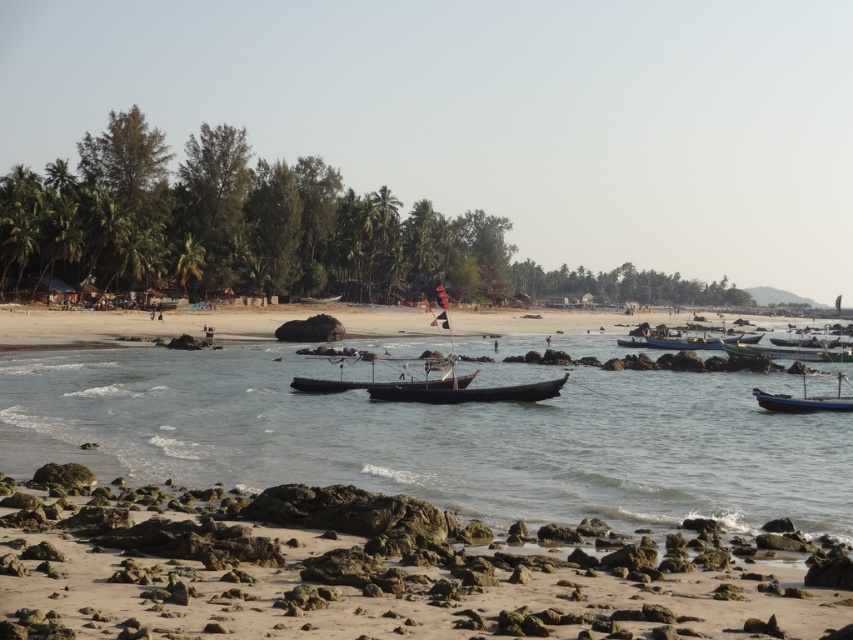
Question: Does green wooden boat at right come in front of blue wooden boat at lower right?

Choices:
 (A) no
 (B) yes

Answer: (A)

Question: Can you confirm if clear water at center is positioned to the left of dark brown wooden canoe at center?

Choices:
 (A) no
 (B) yes

Answer: (B)

Question: Which point appears farthest from the camera in this image?

Choices:
 (A) (663, 480)
 (B) (813, 360)
 (C) (296, 376)

Answer: (B)

Question: Which object is closer to the camera taking this photo?

Choices:
 (A) smooth sand beach at center
 (B) green wooden boat at right
 (C) clear water at center

Answer: (C)

Question: Which point appears closest to the camera in this image?

Choices:
 (A) (654, 516)
 (B) (180, 312)

Answer: (A)

Question: Observing the image, what is the correct spatial positioning of clear water at center in reference to dark brown wooden canoe at center?

Choices:
 (A) above
 (B) below

Answer: (A)